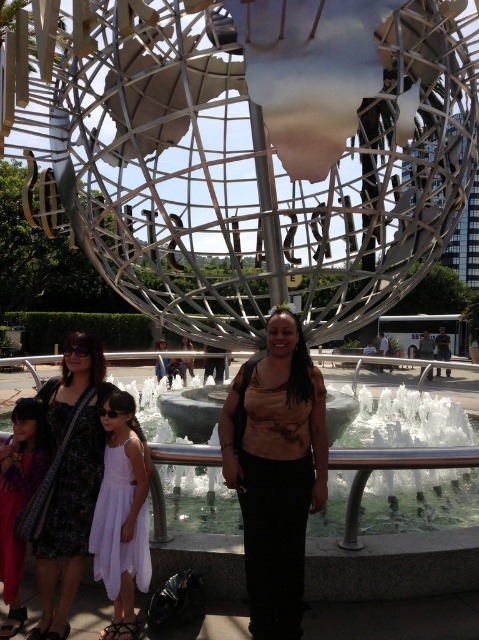
You are standing in the outdoor scene and want to take a photo of both the white marble fountain at center and the white chiffon dress at center. Which object should you position to your left side to include both in the frame?

Since the white marble fountain at center is to the right of the white chiffon dress at center, you should position the white chiffon dress at center to your left side so that the white marble fountain at center will naturally be on the right side of the frame, allowing both to be captured in the photo.

You are planning to place a small statue of a bird on the scene. The statue is 1 foot tall. Considering the white marble fountain at center and the matte purple dress at lower left, which object would be more appropriate to place the statue on top of?

The white marble fountain at center is larger in size than the matte purple dress at lower left, so the statue would be more appropriately placed on the white marble fountain at center.

You are standing at point (x=399, y=564) in the image. What is located at this point?

The white marble fountain at center is located at point (x=399, y=564).